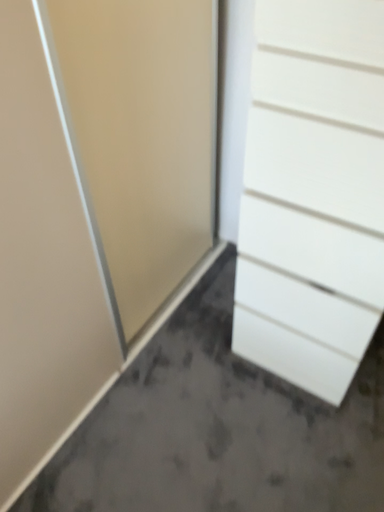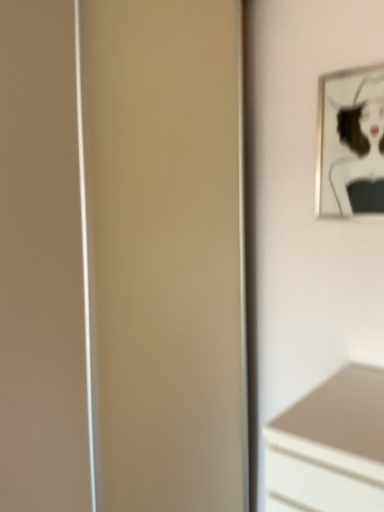
Question: How did the camera likely rotate when shooting the video?

Choices:
 (A) rotated downward
 (B) rotated upward

Answer: (B)